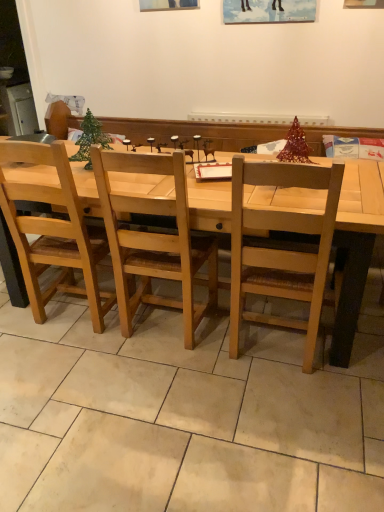
Find the location of `vacant region in front of natural wood table at center`. vacant region in front of natural wood table at center is located at coordinates (160, 410).